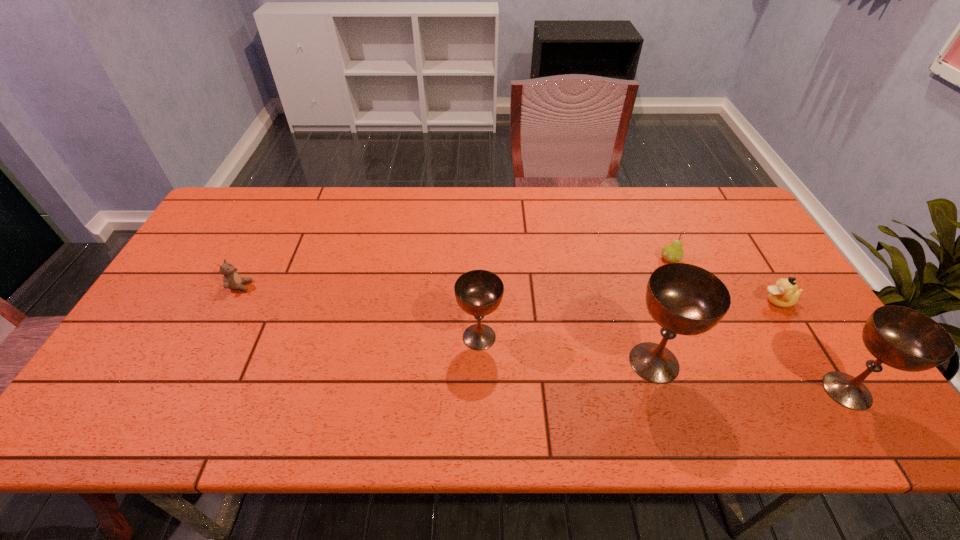
Where is `free space for a new chalice on the left`? free space for a new chalice on the left is located at coordinates (320, 314).